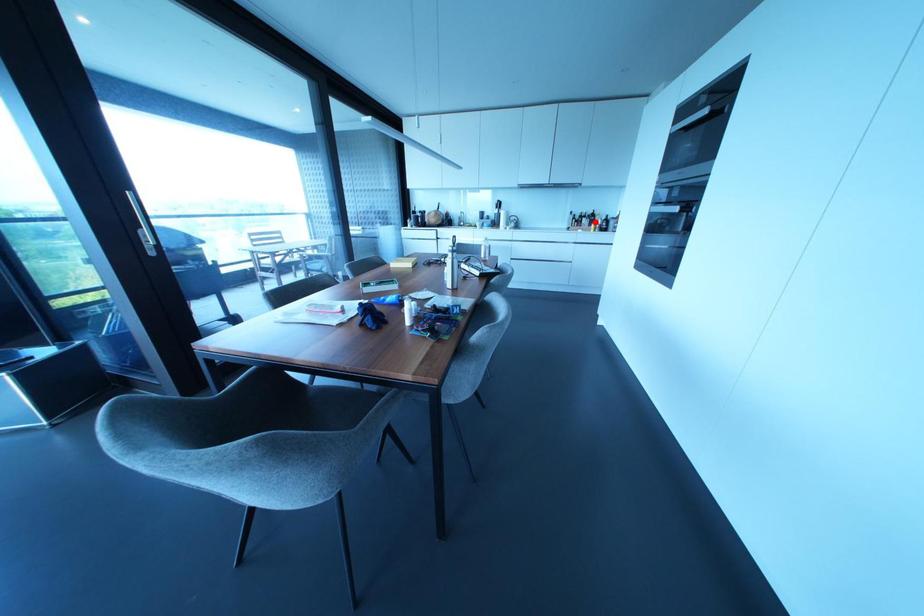
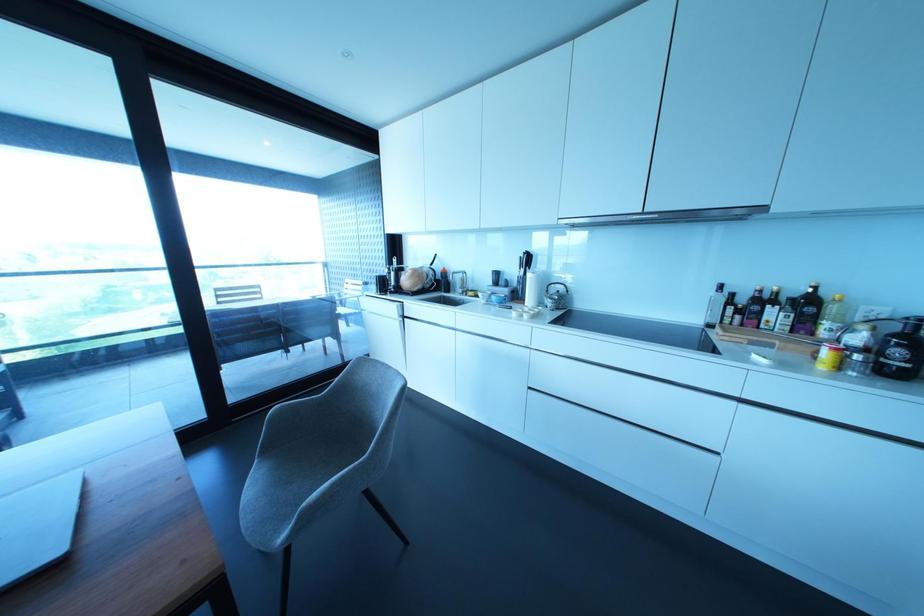
Question: I am providing you with two images of the same scene from different viewpoints. Image1 has a red point marked. In image2, the corresponding 3D location appears at what relative position? Reply with the corresponding letter.

Choices:
 (A) Closer
 (B) Farther

Answer: (B)